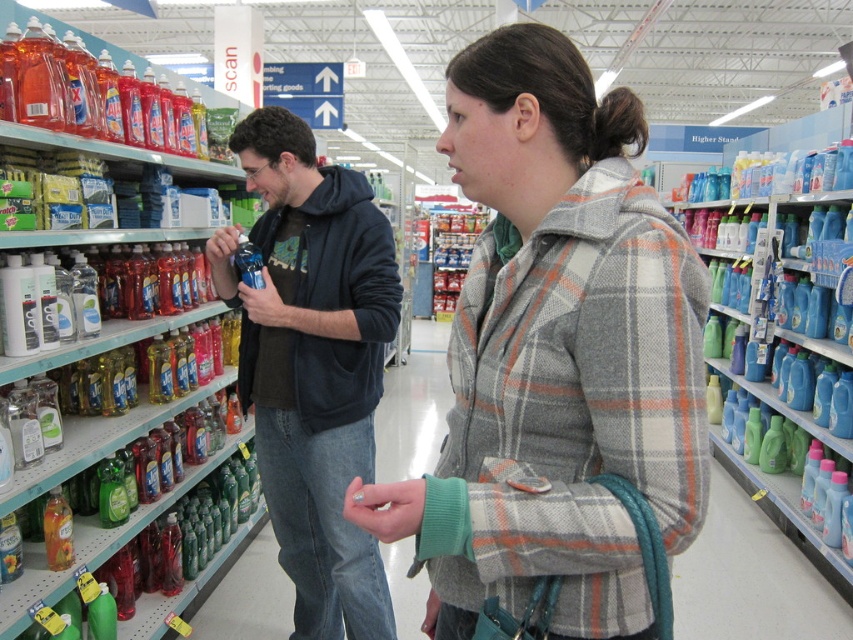
Is plaid woolen jacket at center positioned at the back of translucent plastic bottles at left?

No, plaid woolen jacket at center is in front of translucent plastic bottles at left.

Can you confirm if plaid woolen jacket at center is positioned to the left of translucent plastic bottles at left?

Incorrect, plaid woolen jacket at center is not on the left side of translucent plastic bottles at left.

At what (x,y) coordinates should I click in order to perform the action: click on plaid woolen jacket at center. Please return your answer as a coordinate pair (x, y). The width and height of the screenshot is (853, 640). Looking at the image, I should click on (555, 356).

You are a GUI agent. You are given a task and a screenshot of the screen. Output one action in this format:
    pyautogui.click(x=<x>, y=<y>)
    Task: Click on the plaid woolen jacket at center
    
    Given the screenshot: What is the action you would take?
    coord(555,356)

Between plaid woolen jacket at center and dark blue hoodie at center, which one has less height?

plaid woolen jacket at center is shorter.

Does point (572, 560) lie behind point (259, 184)?

That is False.

The height and width of the screenshot is (640, 853). What do you see at coordinates (555, 356) in the screenshot?
I see `plaid woolen jacket at center` at bounding box center [555, 356].

Identify the location of plaid woolen jacket at center. (555, 356).

Can you confirm if plaid woolen jacket at center is positioned to the right of blue plastic detergent bottles at right?

Incorrect, plaid woolen jacket at center is not on the right side of blue plastic detergent bottles at right.

Does plaid woolen jacket at center have a greater height compared to blue plastic detergent bottles at right?

No, plaid woolen jacket at center is not taller than blue plastic detergent bottles at right.

Does point (483, 326) come behind point (735, 433)?

No, (483, 326) is closer to viewer.

Where is `plaid woolen jacket at center`? plaid woolen jacket at center is located at coordinates (555, 356).